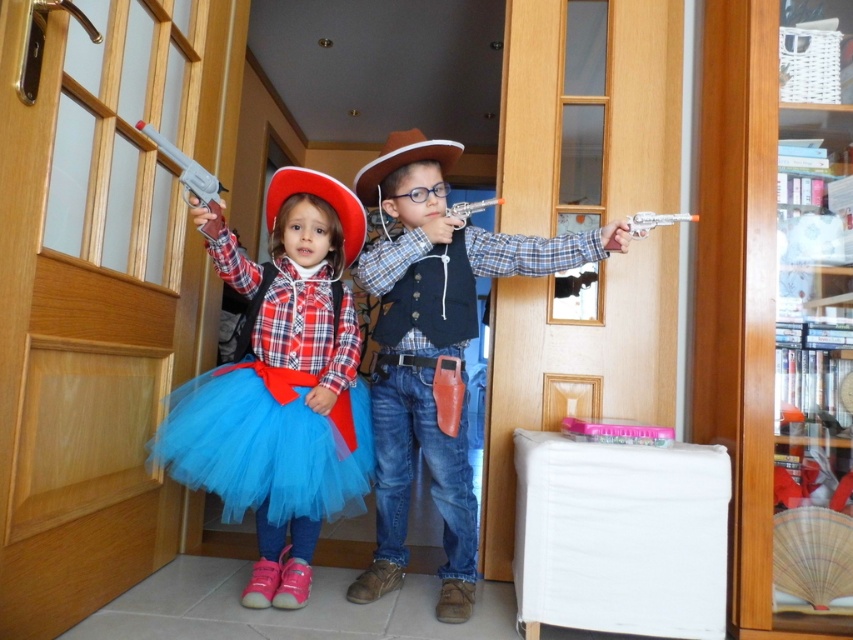
Based on the photo, you are a robot navigating a hallway and need to move from point A to point B. Point A is at coordinates point (x=267, y=465) and point B is at coordinates point (x=309, y=499). According to the scene description, which point is closer to the wooden door with glass panels?

Point (x=267, y=465) is in front of point (x=309, y=499), so point (x=267, y=465) is closer to the wooden door with glass panels.

You are a costume designer trying to fit a new costume piece between the matte black vest at center and the blue tulle ballet skirt at center. Which object has a wider width to ensure proper spacing?

The matte black vest at center has a wider width than the blue tulle ballet skirt at center, so it requires more space.

You are a costume designer trying to arrange two items from the image on a mannequin. The items are the matte black vest at center and the blue tulle ballet skirt at center. Which item should you place higher on the mannequin to match the original image?

The matte black vest at center should be placed higher on the mannequin since it has a greater height compared to the blue tulle ballet skirt at center.